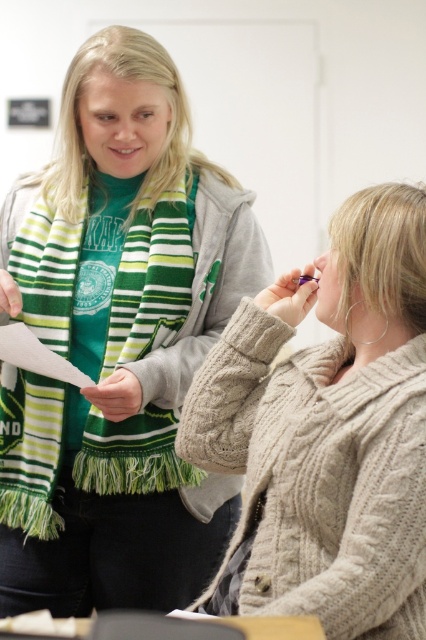
Question: Does green knitted scarf at upper left appear under cable-knit sweater at center?

Choices:
 (A) no
 (B) yes

Answer: (A)

Question: Which point is closer to the camera taking this photo?

Choices:
 (A) (273, 416)
 (B) (68, 145)

Answer: (A)

Question: Does green knitted scarf at upper left appear under cable-knit sweater at center?

Choices:
 (A) no
 (B) yes

Answer: (A)

Question: Can you confirm if green knitted scarf at upper left is smaller than cable-knit sweater at center?

Choices:
 (A) yes
 (B) no

Answer: (B)